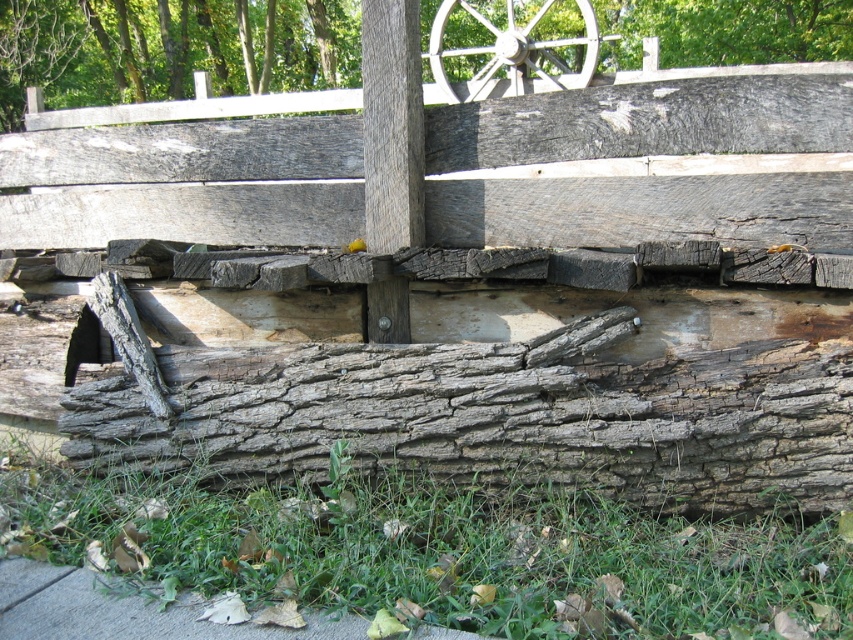
Question: Does green rough grass at lower center appear on the left side of smooth gray wood at upper center?

Choices:
 (A) no
 (B) yes

Answer: (A)

Question: Is weathered brown wood at lower center bigger than smooth gray wood at upper center?

Choices:
 (A) yes
 (B) no

Answer: (A)

Question: Which point is farther from the camera taking this photo?

Choices:
 (A) (548, 1)
 (B) (618, 26)

Answer: (B)

Question: Among these objects, which one is nearest to the camera?

Choices:
 (A) smooth gray wood at upper center
 (B) green rough grass at lower center

Answer: (B)

Question: From the image, what is the correct spatial relationship of smooth gray wood at upper center in relation to white wooden wheel at upper center?

Choices:
 (A) below
 (B) above

Answer: (B)

Question: Which object appears farthest from the camera in this image?

Choices:
 (A) white wooden wheel at upper center
 (B) smooth gray wood at upper center
 (C) green rough grass at lower center
 (D) weathered brown wood at lower center

Answer: (B)